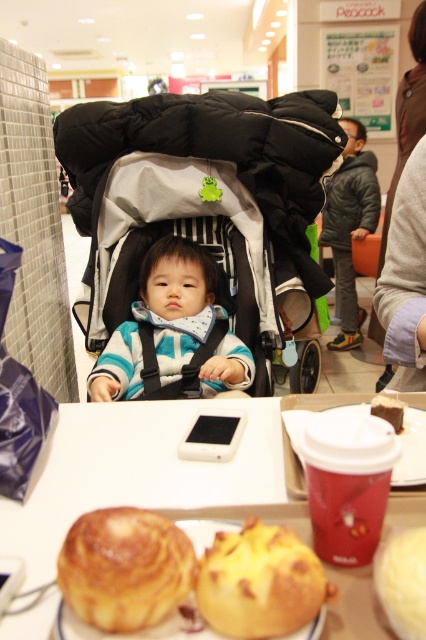
Locate an element on the screen. This screenshot has width=426, height=640. golden-brown crusty bun at lower left is located at coordinates (124, 566).

The width and height of the screenshot is (426, 640). In order to click on golden-brown crusty bun at lower left in this screenshot , I will do `click(124, 566)`.

What are the coordinates of `golden-brown crusty bun at lower left` in the screenshot? It's located at (124, 566).

What do you see at coordinates (204, 202) in the screenshot?
I see `black fabric baby carriage at center` at bounding box center [204, 202].

Which is behind, point (75, 172) or point (288, 456)?

Positioned behind is point (75, 172).

Measure the distance between black fabric baby carriage at center and camera.

A distance of 1.61 meters exists between black fabric baby carriage at center and camera.

Identify the location of black fabric baby carriage at center. Image resolution: width=426 pixels, height=640 pixels. (204, 202).

Consider the image. Who is taller, golden crusty bread at center or yellow matte bread at center?

Standing taller between the two is golden crusty bread at center.

Between golden crusty bread at center and yellow matte bread at center, which one is positioned higher?

Positioned higher is golden crusty bread at center.

Who is more distant from viewer, [258,547] or [394,547]?

Point [394,547]

This screenshot has height=640, width=426. Find the location of `golden crusty bread at center`. golden crusty bread at center is located at coordinates (259, 582).